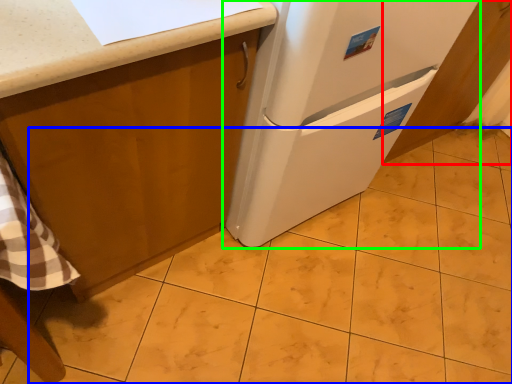
Question: Which object is the farthest from cabinetry (highlighted by a red box)? Choose among these: tile (highlighted by a blue box) or refrigerator (highlighted by a green box).

Choices:
 (A) tile
 (B) refrigerator

Answer: (A)